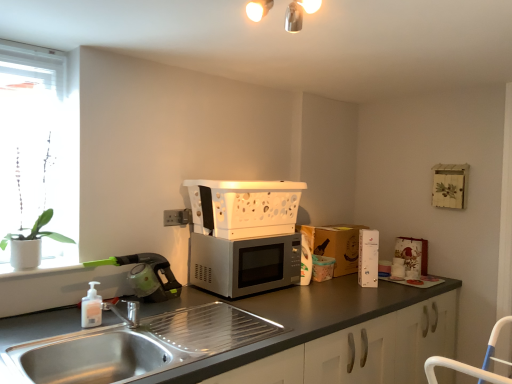
This screenshot has width=512, height=384. Find the location of `free space in front of white cardboard box at right, which ranks as the 3th appliance in left-to-right order`. free space in front of white cardboard box at right, which ranks as the 3th appliance in left-to-right order is located at coordinates point(372,288).